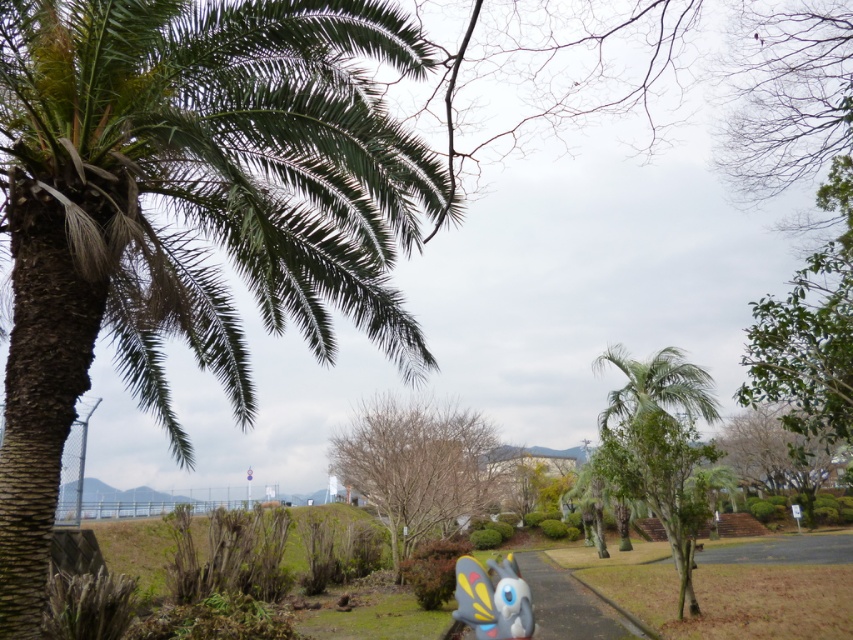
Based on the photo, you are a gardener planning to place a new small plant between the bare wood tree at center and the matte plastic butterfly at lower center. Which object should you position the plant closer to so that it doesn

The bare wood tree at center is larger in size than the matte plastic butterfly at lower center, so positioning the plant closer to the matte plastic butterfly at lower center would ensure adequate space for both the plant and the larger tree.

You are a gardener who wants to place a new flower pot between the green leafy palm at left and the matte plastic butterfly at lower center. Based on their positions, where should the flower pot be placed?

The flower pot should be placed between the green leafy palm at left and the matte plastic butterfly at lower center, as the green leafy palm at left is positioned on the left side of the matte plastic butterfly at lower center.

You are a gardener planning to water the bare wood tree at center and the matte plastic butterfly at lower center. Which object should you water first if you want to start with the one closer to you?

The bare wood tree at center should be watered first because it is closer to the viewer than the matte plastic butterfly at lower center.